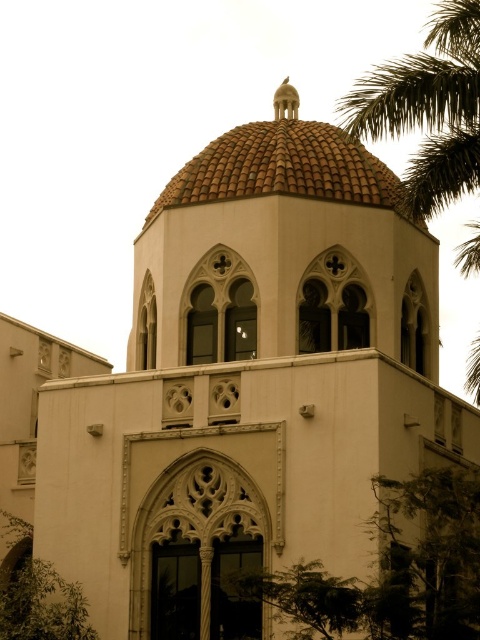
You are standing in front of the building and want to take a photo that includes both the green leafy tree at lower right and the green leafy palm tree at upper right. Which tree should you position closer to the center of your camera frame to ensure both are fully visible?

You should position the green leafy palm tree at upper right closer to the center of your camera frame because it is larger than the green leafy tree at lower right, ensuring both are fully visible.

You are standing in front of the building and notice a green leafy palm tree at upper right and a brown tiled dome at upper center. Which object is located higher up in the image?

The green leafy palm tree at upper right is positioned over the brown tiled dome at upper center, meaning it is higher up in the image.